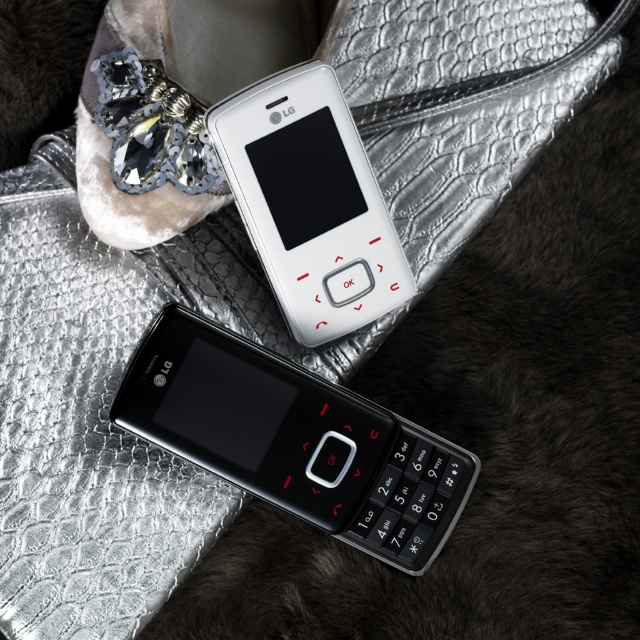
You are an interior designer arranging items on a snakeskin table. You have two LG flip phones and a decorative shoe. The white phone is at the top, the black phone is below it, and the shoe is in the background. You need to place a new red button accessory exactly where the point at coordinates (294, 440) is located. Which object will this accessory be placed on or near?

The point at coordinates (294, 440) indicates the black matte phone at center, so the accessory will be placed on or near the black matte phone at center.

You are a delivery person who needs to place a new phone on the table between the black matte phone at center and the white phone at top. The new phone is 15 cm long. Is there enough space between them?

The black matte phone at center and the white phone at top are 1.10 meters apart, so yes, the new phone will fit between them since 15 cm is less than 1.10 meters.